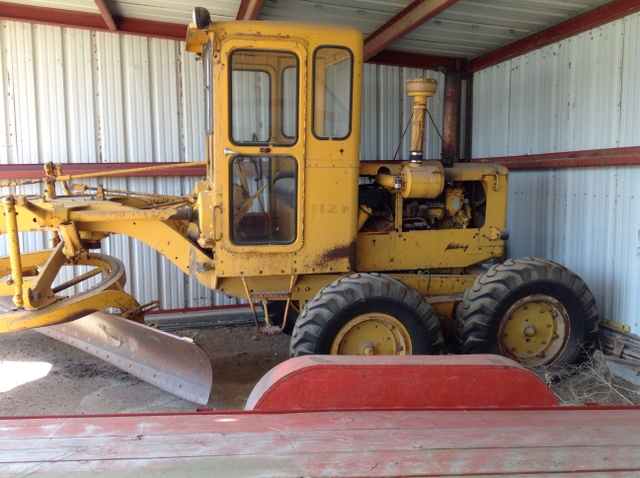
The width and height of the screenshot is (640, 478). Find the location of `seat`. seat is located at coordinates (344, 195), (282, 198), (285, 188).